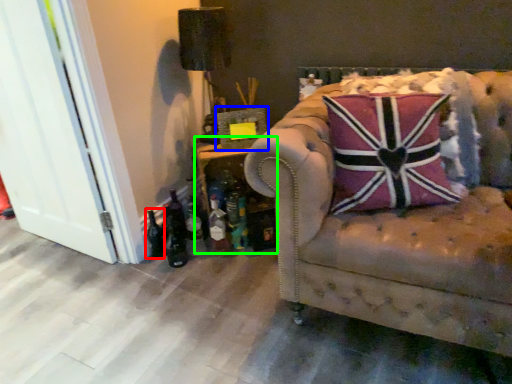
Question: Which object is the closest to the bottle (highlighted by a red box)? Choose among these: picture frame (highlighted by a blue box) or table (highlighted by a green box).

Choices:
 (A) picture frame
 (B) table

Answer: (B)